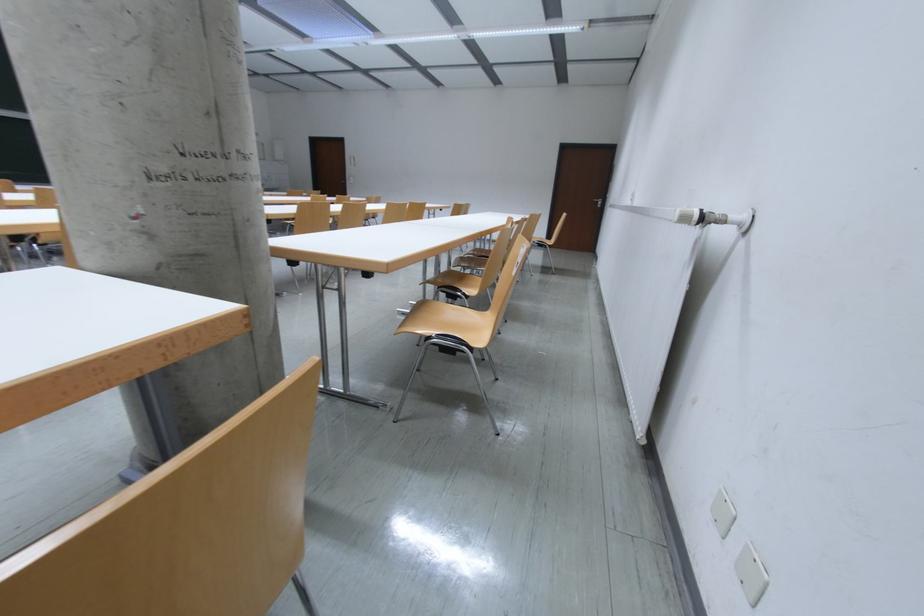
Locate an element on the screen. chair sitting surface is located at coordinates (447, 322).